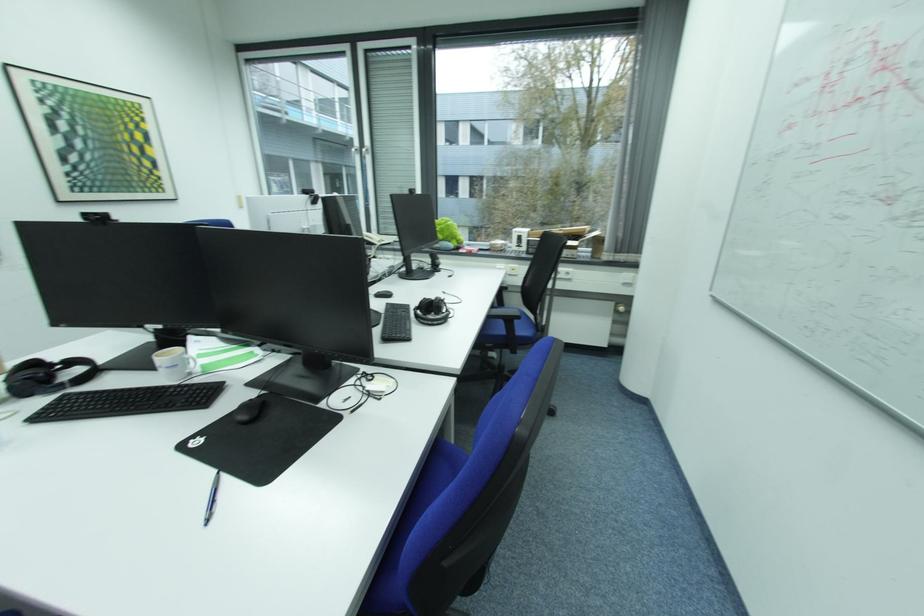
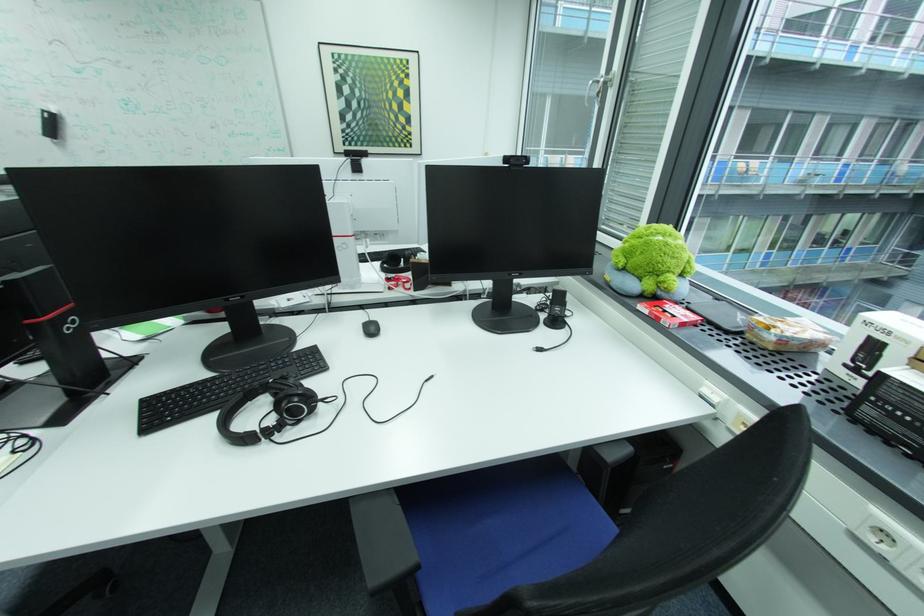
Where in the second image is the point corresponding to point 508,246 from the first image?

(781, 339)